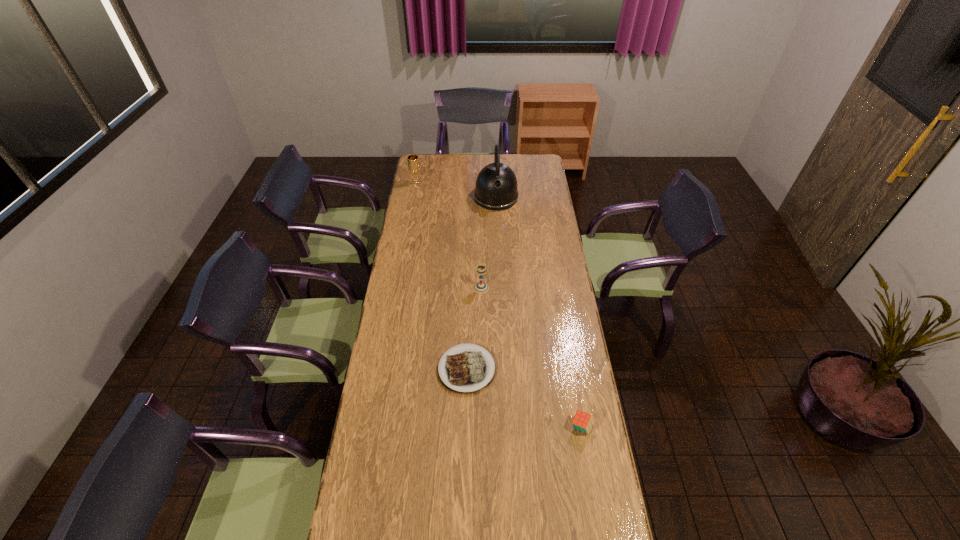
The width and height of the screenshot is (960, 540). What are the coordinates of `vacant region located on the right of the left chalice` in the screenshot? It's located at (448, 183).

The image size is (960, 540). Identify the location of free location located on the right of the third nearest object. (528, 288).

At what (x,y) coordinates should I click in order to perform the action: click on free space located on the back of the rightmost object. Please return your answer as a coordinate pair (x, y). Looking at the image, I should click on (573, 376).

Identify the location of blank area located on the back of the fourth farthest object. (468, 285).

At what (x,y) coordinates should I click in order to perform the action: click on object that is at the left edge. Please return your answer as a coordinate pair (x, y). The width and height of the screenshot is (960, 540). Looking at the image, I should click on (413, 162).

The width and height of the screenshot is (960, 540). I want to click on object located in the right edge section of the desktop, so click(x=582, y=421).

The width and height of the screenshot is (960, 540). Find the location of `vacant area at the far edge of the desktop`. vacant area at the far edge of the desktop is located at coordinates (462, 163).

This screenshot has width=960, height=540. In order to click on vacant position at the left edge of the desktop in this screenshot , I will do `click(425, 187)`.

This screenshot has width=960, height=540. Find the location of `blank region between the plate and the fourth shortest object`. blank region between the plate and the fourth shortest object is located at coordinates (442, 276).

Where is `blank region between the plate and the leftmost object`? This screenshot has width=960, height=540. blank region between the plate and the leftmost object is located at coordinates (442, 276).